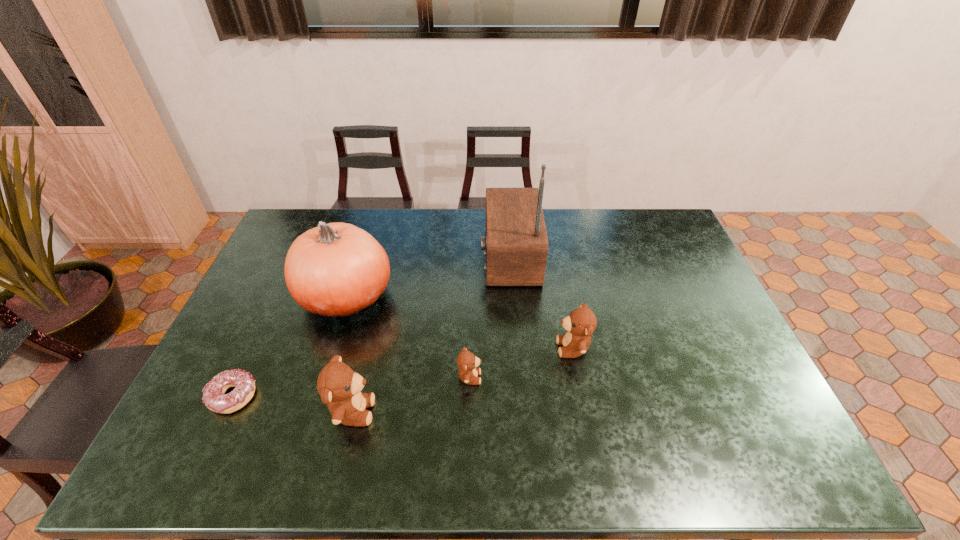
Given the evenly spaced teddy bears in the image, where should an extra teddy bear be added on the right to preserve the spacing? Please point to a vacant space. Please provide its 2D coordinates. Your answer should be formatted as a tuple, i.e. [(x, y)], where the tuple contains the x and y coordinates of a point satisfying the conditions above.

[(665, 321)]